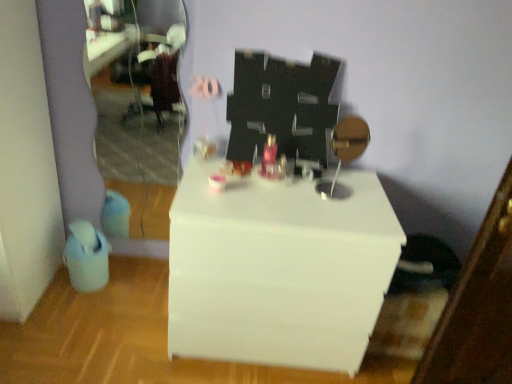
The width and height of the screenshot is (512, 384). I want to click on free space above white glossy table at center (from a real-world perspective), so click(x=293, y=195).